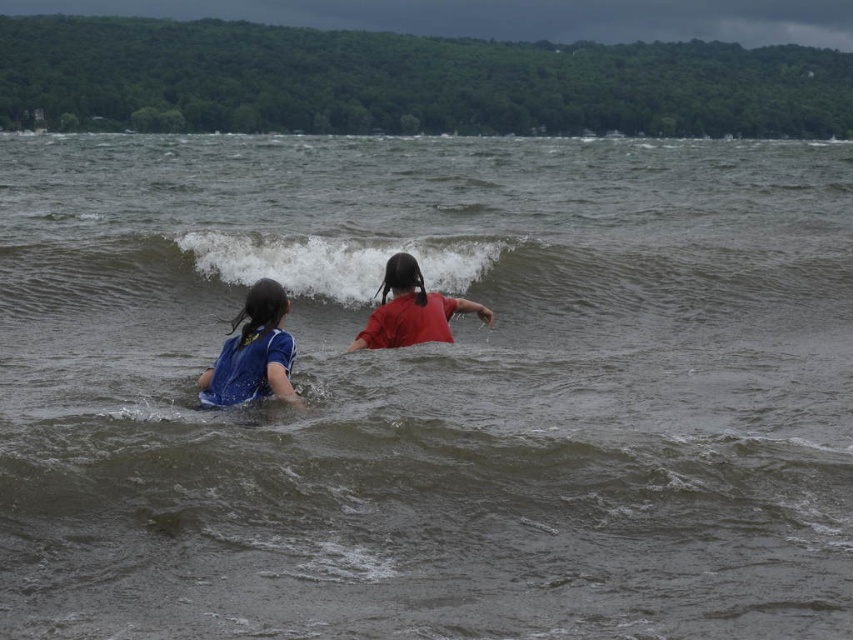
You are a photographer trying to capture the blue fabric shirt at center in the image. The camera is set to focus on the point at coordinates [253,353]. Will the blue fabric shirt at center be in focus?

Yes, the point at coordinates [253,353] indicates the blue fabric shirt at center, so the camera will focus on it and the blue fabric shirt at center will be in focus.

Consider the image. You are a photographer trying to capture a group photo of the blue fabric shirt at center and the red matte shirt at center. Your camera has a maximum focus range of 10 feet. Can you take a photo of both individuals at the same time without moving the camera?

The blue fabric shirt at center and red matte shirt at center are 9.80 feet apart, so yes, the photographer can take a photo of both individuals at the same time since the distance between them is within the camera maximum focus range of 10 feet.

You are a photographer trying to capture a clear shot of the blue fabric shirt at center and the white frothy wave at center. Which object is closer to the camera, and why?

The white frothy wave at center is closer to the camera because the blue fabric shirt at center is positioned behind it.